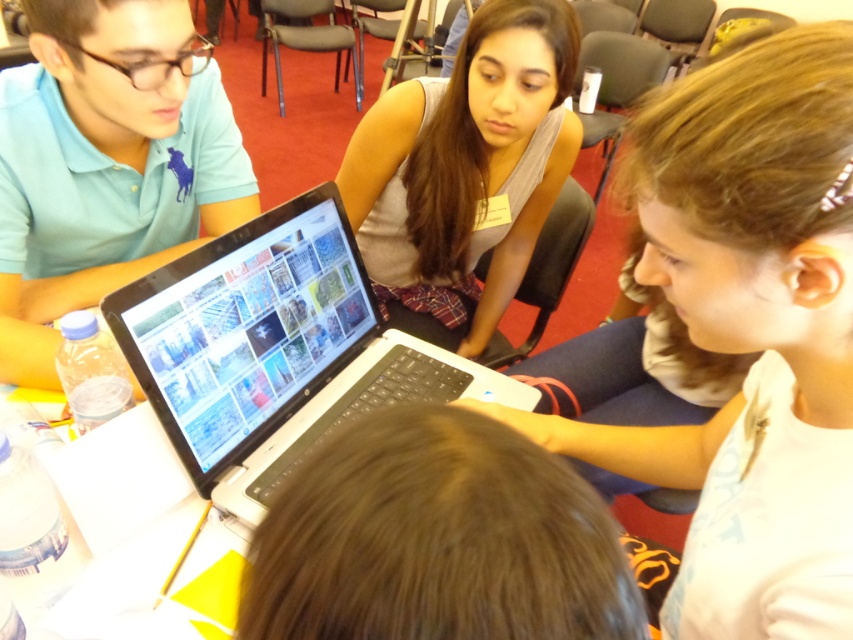
Question: Where is white plastic laptop at center located in relation to matte blue polo shirt at left in the image?

Choices:
 (A) above
 (B) below

Answer: (B)

Question: Is brown hair at center wider than matte gray shirt at center?

Choices:
 (A) yes
 (B) no

Answer: (B)

Question: Which point is farther to the camera?

Choices:
 (A) matte blue polo shirt at left
 (B) brown hair at center
 (C) white plastic laptop at center
 (D) matte gray shirt at center

Answer: (D)

Question: Among these points, which one is nearest to the camera?

Choices:
 (A) (172, 172)
 (B) (515, 1)

Answer: (B)

Question: Is brown hair at center smaller than matte blue polo shirt at left?

Choices:
 (A) no
 (B) yes

Answer: (B)

Question: Which object is the closest to the white matte laptop at center?

Choices:
 (A) matte blue polo shirt at left
 (B) brown hair at center
 (C) white plastic laptop at center

Answer: (C)